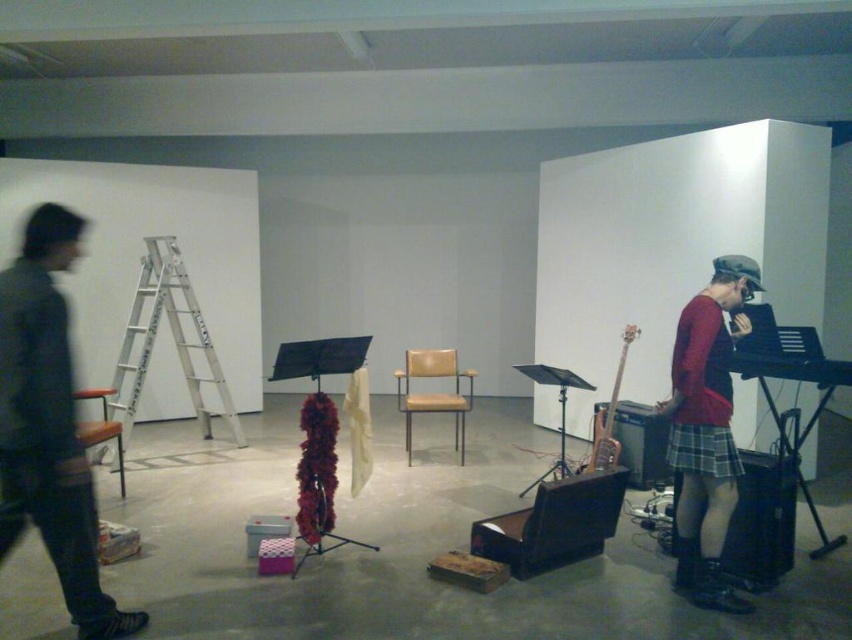
Question: From the image, what is the correct spatial relationship of dark gray sweater at left in relation to wooden chair at left?

Choices:
 (A) left
 (B) right

Answer: (B)

Question: Is silver metallic ladder at left behind translucent wood bass guitar at right?

Choices:
 (A) yes
 (B) no

Answer: (A)

Question: Which point appears closest to the camera in this image?

Choices:
 (A) (153, 337)
 (B) (707, 300)
 (C) (87, 438)
 (D) (42, 413)

Answer: (D)

Question: Which of the following is the closest to the observer?

Choices:
 (A) wooden chair at left
 (B) dark gray sweater at left

Answer: (B)

Question: Which object is positioned farthest from the wooden chair at left?

Choices:
 (A) dark gray sweater at left
 (B) plaid fabric skirt at lower right
 (C) red matte sweater at right

Answer: (C)

Question: Is dark gray sweater at left bigger than tan leather chair at center?

Choices:
 (A) no
 (B) yes

Answer: (A)